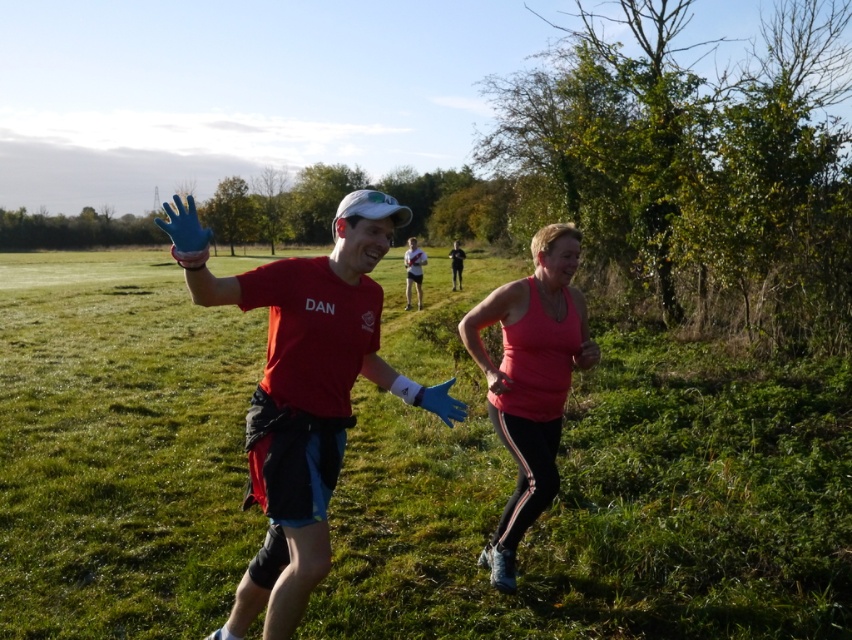
Question: Among these objects, which one is nearest to the camera?

Choices:
 (A) matte blue gloves at center
 (B) pink fabric tank top at center

Answer: (A)

Question: Which point appears farthest from the camera in this image?

Choices:
 (A) (248, 410)
 (B) (582, 340)

Answer: (A)

Question: Is green grassy field at center above pink fabric tank top at center?

Choices:
 (A) no
 (B) yes

Answer: (B)

Question: Which of the following is the closest to the observer?

Choices:
 (A) matte blue gloves at center
 (B) pink fabric tank top at center

Answer: (A)

Question: Is green grassy field at center thinner than pink fabric tank top at center?

Choices:
 (A) no
 (B) yes

Answer: (A)

Question: Does matte blue gloves at center have a lesser width compared to pink fabric tank top at center?

Choices:
 (A) no
 (B) yes

Answer: (A)